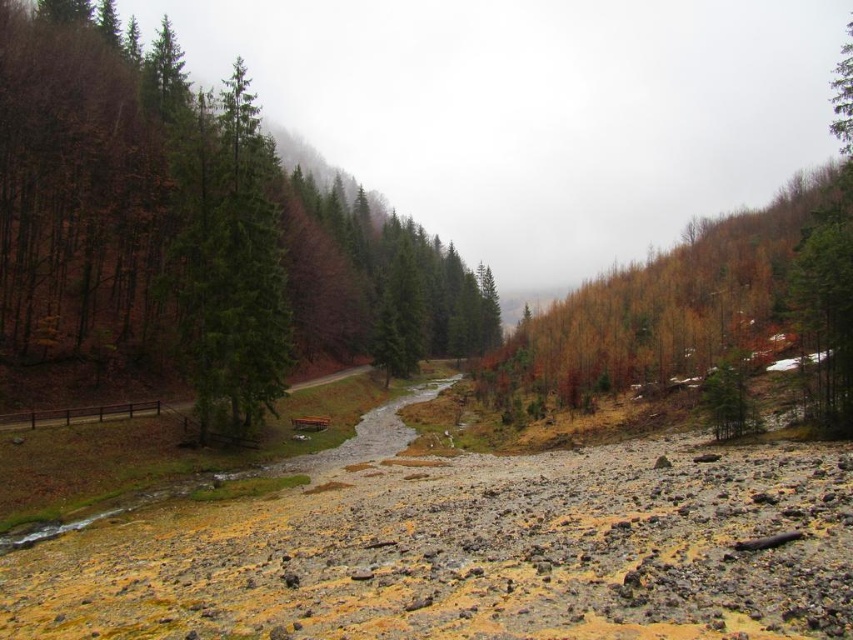
You are a hiker standing at the edge of the forest valley. You see the green matte tree at left and the green glossy tree at center. Which tree is closer to you?

The green matte tree at left is closer to you because it is positioned further to the viewer than the green glossy tree at center, meaning it appears nearer in the scene.

You are standing at the center of the valley and want to find the green matte tree at left. According to the coordinates provided, in which direction should you look to locate it?

The green matte tree at left is located at coordinates point (190, 234), which means you should look to the left side of the valley to find it.